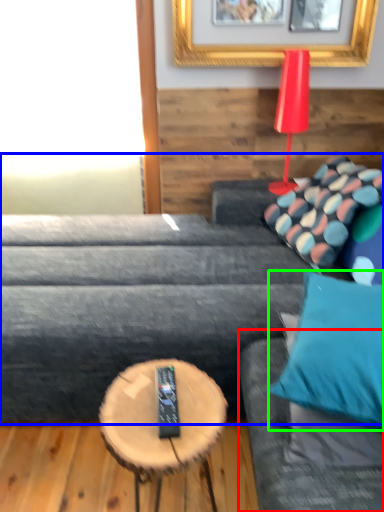
Question: Considering the real-world distances, which object is closest to couch (highlighted by a red box)? studio couch (highlighted by a blue box) or pillow (highlighted by a green box).

Choices:
 (A) studio couch
 (B) pillow

Answer: (B)